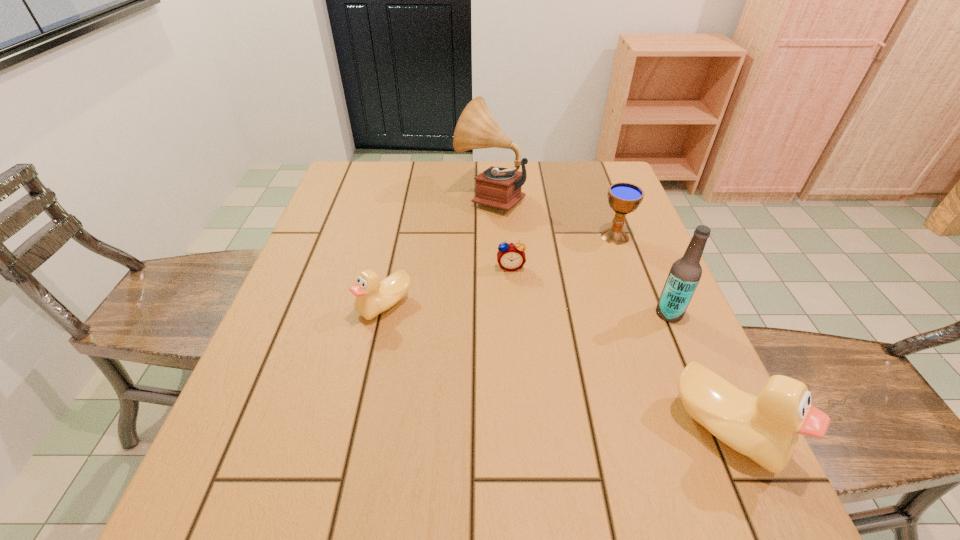
To ensure equal spacing by inserting another duck among them, please point out a vacant spot for this new duck. Please provide its 2D coordinates. Your answer should be formatted as a tuple, i.e. [(x, y)], where the tuple contains the x and y coordinates of a point satisfying the conditions above.

[(534, 360)]